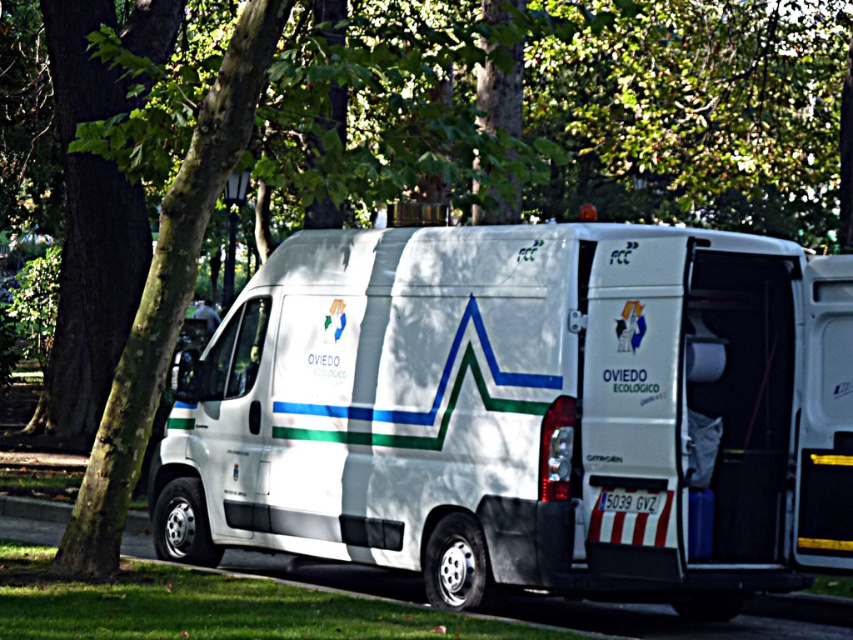
You are a delivery driver who needs to park your white matte van at center in a specific spot marked at coordinates 0.647, 0.617. Can you confirm if the van is already parked correctly?

The white matte van at center is positioned exactly at point (x=525, y=413), so it is parked correctly in the designated spot.

You are a delivery driver who needs to park your vehicle under a tree to avoid the sun. You see the white matte van at center and the green leafy tree at upper left in the image. Which object is shorter, and therefore more suitable for parking under to avoid hitting the tree branches?

The white matte van at center has a lesser height compared to the green leafy tree at upper left, so it is shorter and more suitable for parking under the tree to avoid hitting the branches.

Consider the image. You are a photographer trying to capture both the white matte van at center and the green leafy tree at upper left in a single shot. Based on their sizes in the image, which object would require you to adjust your camera position to include fully in the frame?

The green leafy tree at upper left is larger than the white matte van at center, so you would need to adjust your camera position to include the entire tree in the frame.